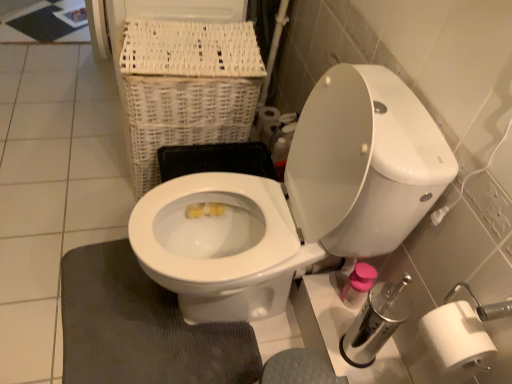
Question: Choose the correct answer: Is dark gray textured bath mat at lower left inside white matte toilet paper at right or outside it?

Choices:
 (A) inside
 (B) outside

Answer: (B)

Question: In terms of size, does dark gray textured bath mat at lower left appear bigger or smaller than white matte toilet paper at right?

Choices:
 (A) big
 (B) small

Answer: (A)

Question: Which object is positioned closest to the dark gray textured bath mat at lower left?

Choices:
 (A) white wicker basket at upper left
 (B) white glossy toilet at center
 (C) white matte toilet paper at right

Answer: (B)

Question: Which object is the farthest from the white matte toilet paper at right?

Choices:
 (A) white wicker basket at upper left
 (B) white glossy toilet at center
 (C) dark gray textured bath mat at lower left

Answer: (C)